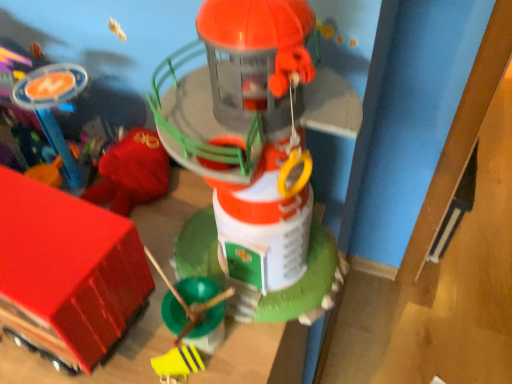
Question: Does smooth plastic toy at center, the third toy viewed from the left, appear on the left side of yellow matte toy at lower center, marked as the second toy in a left-to-right arrangement?

Choices:
 (A) yes
 (B) no

Answer: (B)

Question: Would you consider smooth plastic toy at center, the third toy viewed from the left, to be distant from yellow matte toy at lower center, marked as the second toy in a left-to-right arrangement?

Choices:
 (A) no
 (B) yes

Answer: (A)

Question: Can you confirm if smooth plastic toy at center, the third toy viewed from the left, is shorter than yellow matte toy at lower center, marked as the second toy in a left-to-right arrangement?

Choices:
 (A) yes
 (B) no

Answer: (B)

Question: Is smooth plastic toy at center, which is the 1th toy from right to left, in contact with yellow matte toy at lower center, marked as the second toy in a left-to-right arrangement?

Choices:
 (A) yes
 (B) no

Answer: (B)

Question: Could you tell me if smooth plastic toy at center, the third toy viewed from the left, is facing yellow matte toy at lower center, the second toy positioned from the right?

Choices:
 (A) yes
 (B) no

Answer: (A)

Question: Is rubberized red truck at lower left, arranged as the third toy when viewed from the right, to the left or to the right of smooth plastic toy at center, the third toy viewed from the left, in the image?

Choices:
 (A) left
 (B) right

Answer: (A)

Question: Based on their sizes in the image, would you say rubberized red truck at lower left, arranged as the third toy when viewed from the right, is bigger or smaller than smooth plastic toy at center, the third toy viewed from the left?

Choices:
 (A) big
 (B) small

Answer: (B)

Question: From a real-world perspective, is rubberized red truck at lower left, arranged as the third toy when viewed from the right, above or below smooth plastic toy at center, the third toy viewed from the left?

Choices:
 (A) above
 (B) below

Answer: (B)

Question: In the image, is rubberized red truck at lower left, arranged as the third toy when viewed from the right, positioned in front of or behind smooth plastic toy at center, the third toy viewed from the left?

Choices:
 (A) front
 (B) behind

Answer: (B)

Question: Considering the positions of yellow matte toy at lower center, marked as the second toy in a left-to-right arrangement, and smooth plastic toy at center, which is the 1th toy from right to left, in the image, is yellow matte toy at lower center, marked as the second toy in a left-to-right arrangement, wider or thinner than smooth plastic toy at center, which is the 1th toy from right to left,?

Choices:
 (A) wide
 (B) thin

Answer: (B)

Question: Considering the positions of yellow matte toy at lower center, marked as the second toy in a left-to-right arrangement, and smooth plastic toy at center, the third toy viewed from the left, in the image, is yellow matte toy at lower center, marked as the second toy in a left-to-right arrangement, taller or shorter than smooth plastic toy at center, the third toy viewed from the left,?

Choices:
 (A) short
 (B) tall

Answer: (A)

Question: Is yellow matte toy at lower center, the second toy positioned from the right, bigger or smaller than smooth plastic toy at center, the third toy viewed from the left?

Choices:
 (A) big
 (B) small

Answer: (B)

Question: Does point (182, 369) appear closer or farther from the camera than point (219, 145)?

Choices:
 (A) farther
 (B) closer

Answer: (A)

Question: Is rubberized red truck at lower left, arranged as the first toy when viewed from the left, inside the boundaries of yellow matte toy at lower center, the second toy positioned from the right, or outside?

Choices:
 (A) inside
 (B) outside

Answer: (B)

Question: From a real-world perspective, is rubberized red truck at lower left, arranged as the first toy when viewed from the left, physically located above or below yellow matte toy at lower center, the second toy positioned from the right?

Choices:
 (A) below
 (B) above

Answer: (B)